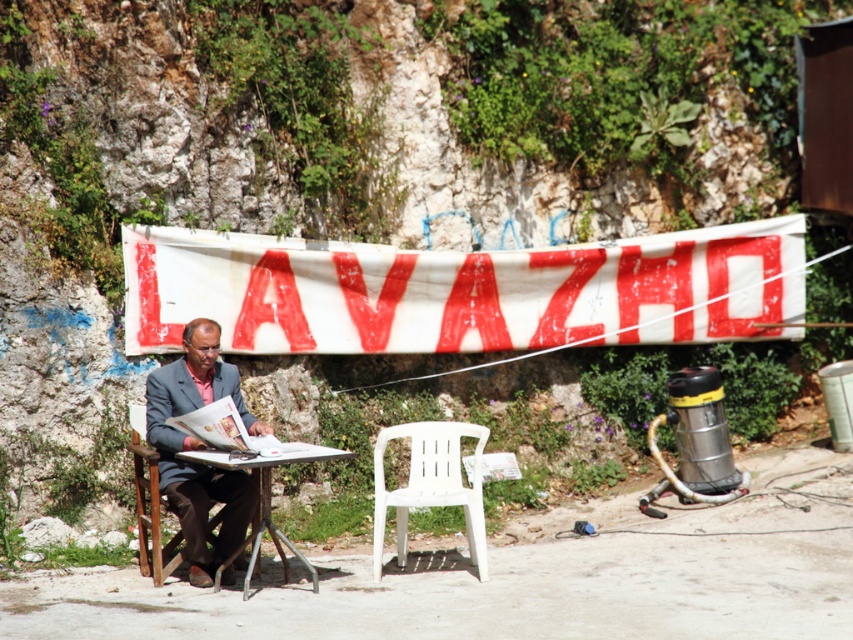
Question: Among these objects, which one is nearest to the camera?

Choices:
 (A) white fabric banner at center
 (B) metallic silver table at center

Answer: (B)

Question: Does white fabric banner at center appear over matte brown suit at center?

Choices:
 (A) no
 (B) yes

Answer: (B)

Question: Can you confirm if white fabric banner at center is positioned above metallic silver table at center?

Choices:
 (A) yes
 (B) no

Answer: (A)

Question: Does white plastic chair at center have a larger size compared to wooden chair at left?

Choices:
 (A) yes
 (B) no

Answer: (B)

Question: Which object appears farthest from the camera in this image?

Choices:
 (A) white plastic chair at center
 (B) white fabric banner at center
 (C) wooden chair at left

Answer: (B)

Question: Among these points, which one is nearest to the camera?

Choices:
 (A) (262, 493)
 (B) (141, 449)
 (C) (177, 372)
 (D) (440, 449)

Answer: (A)